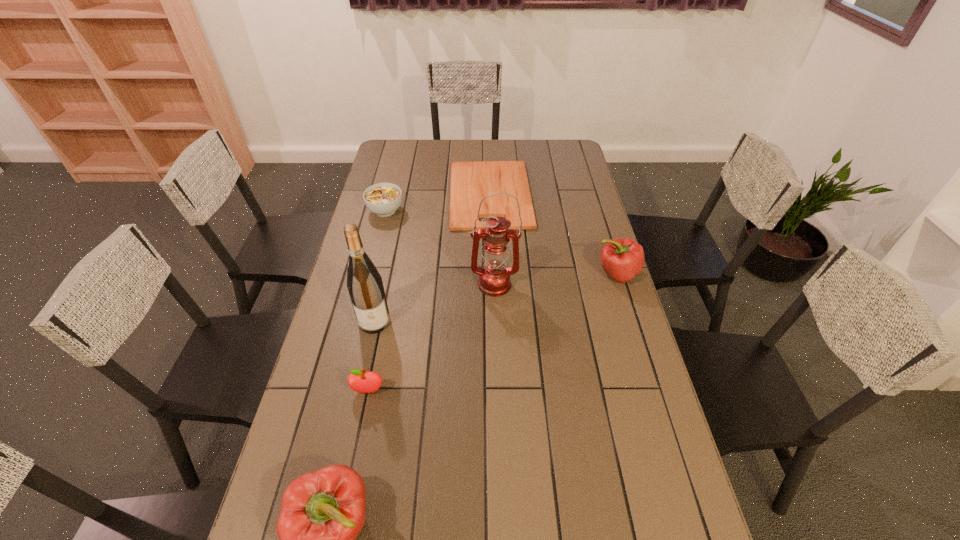
I want to click on location for an additional bell_pepper to make spacing equal, so click(x=507, y=371).